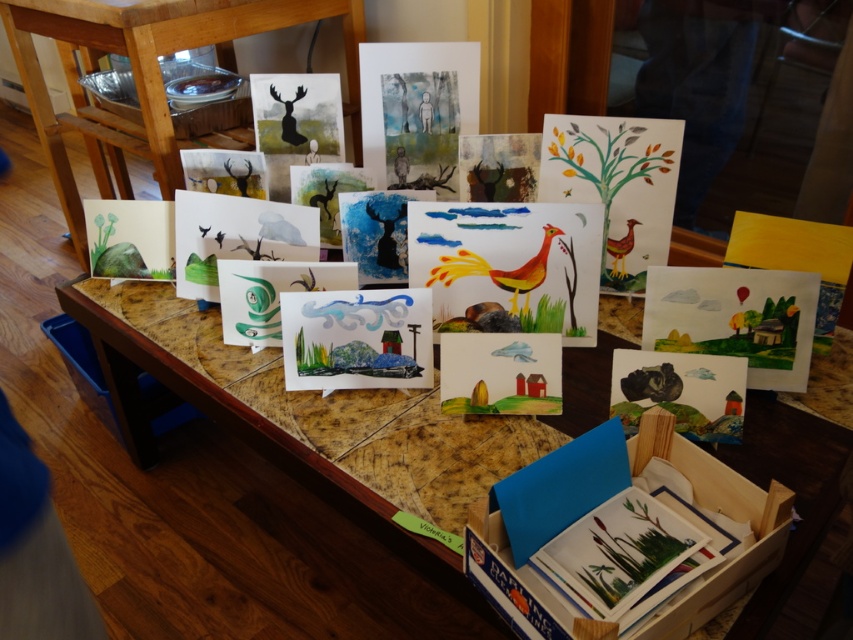
Can you confirm if wooden table at upper left is smaller than watercolor painting at center?

No.

Where is `wooden table at upper left`? The width and height of the screenshot is (853, 640). wooden table at upper left is located at coordinates (144, 76).

Can you confirm if wooden table at center is taller than matte orange bird at right?

Yes.

Which is below, wooden table at center or matte orange bird at right?

Positioned lower is wooden table at center.

Which is in front, point (263, 572) or point (619, 273)?

Positioned in front is point (619, 273).

The height and width of the screenshot is (640, 853). In order to click on wooden table at center in this screenshot , I will do `click(280, 474)`.

How far apart are wooden table at upper left and matte orange bird at right?

wooden table at upper left and matte orange bird at right are 5.20 feet apart.

Is wooden table at upper left taller than matte orange bird at right?

Yes, wooden table at upper left is taller than matte orange bird at right.

Is point (223, 51) positioned before point (628, 228)?

No, (223, 51) is further to viewer.

This screenshot has height=640, width=853. Find the location of `wooden table at upper left`. wooden table at upper left is located at coordinates (144, 76).